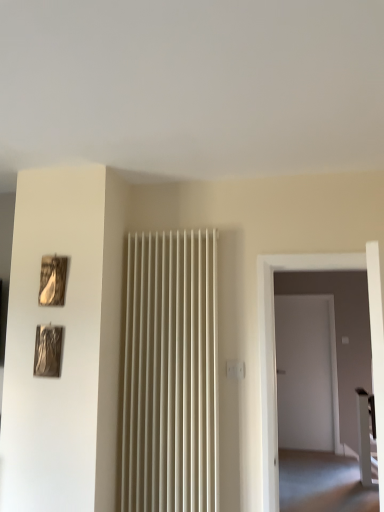
Question: Does white glossy table at right lie in front of metallic silver picture frame at left, marked as the second picture frame in a top-to-bottom arrangement?

Choices:
 (A) yes
 (B) no

Answer: (B)

Question: Is there a large distance between white glossy table at right and metallic silver picture frame at left, which is counted as the 1th picture frame, starting from the bottom?

Choices:
 (A) no
 (B) yes

Answer: (B)

Question: Is white glossy table at right directly adjacent to metallic silver picture frame at left, which is counted as the 1th picture frame, starting from the bottom?

Choices:
 (A) yes
 (B) no

Answer: (B)

Question: From the image's perspective, is white glossy table at right beneath metallic silver picture frame at left, marked as the second picture frame in a top-to-bottom arrangement?

Choices:
 (A) no
 (B) yes

Answer: (B)

Question: Does white glossy table at right have a lesser height compared to metallic silver picture frame at left, marked as the second picture frame in a top-to-bottom arrangement?

Choices:
 (A) yes
 (B) no

Answer: (B)

Question: From a real-world perspective, does white glossy table at right stand above metallic silver picture frame at left, marked as the second picture frame in a top-to-bottom arrangement?

Choices:
 (A) yes
 (B) no

Answer: (B)

Question: Would you consider white glossy table at right to be distant from wooden matte picture frame at upper left, positioned as the 2th picture frame in bottom-to-top order?

Choices:
 (A) no
 (B) yes

Answer: (B)

Question: Considering the relative sizes of white glossy table at right and wooden matte picture frame at upper left, which is the first picture frame from top to bottom, in the image provided, is white glossy table at right bigger than wooden matte picture frame at upper left, which is the first picture frame from top to bottom,?

Choices:
 (A) no
 (B) yes

Answer: (B)

Question: From a real-world perspective, is white glossy table at right on top of wooden matte picture frame at upper left, positioned as the 2th picture frame in bottom-to-top order?

Choices:
 (A) yes
 (B) no

Answer: (B)

Question: From the image's perspective, is white glossy table at right located beneath wooden matte picture frame at upper left, positioned as the 2th picture frame in bottom-to-top order?

Choices:
 (A) no
 (B) yes

Answer: (B)

Question: Can you confirm if white glossy table at right is wider than wooden matte picture frame at upper left, which is the first picture frame from top to bottom?

Choices:
 (A) no
 (B) yes

Answer: (B)

Question: Is white glossy table at right beside wooden matte picture frame at upper left, positioned as the 2th picture frame in bottom-to-top order?

Choices:
 (A) no
 (B) yes

Answer: (A)

Question: Can you confirm if wooden matte picture frame at upper left, which is the first picture frame from top to bottom, is smaller than metallic silver picture frame at left, which is counted as the 1th picture frame, starting from the bottom?

Choices:
 (A) yes
 (B) no

Answer: (A)